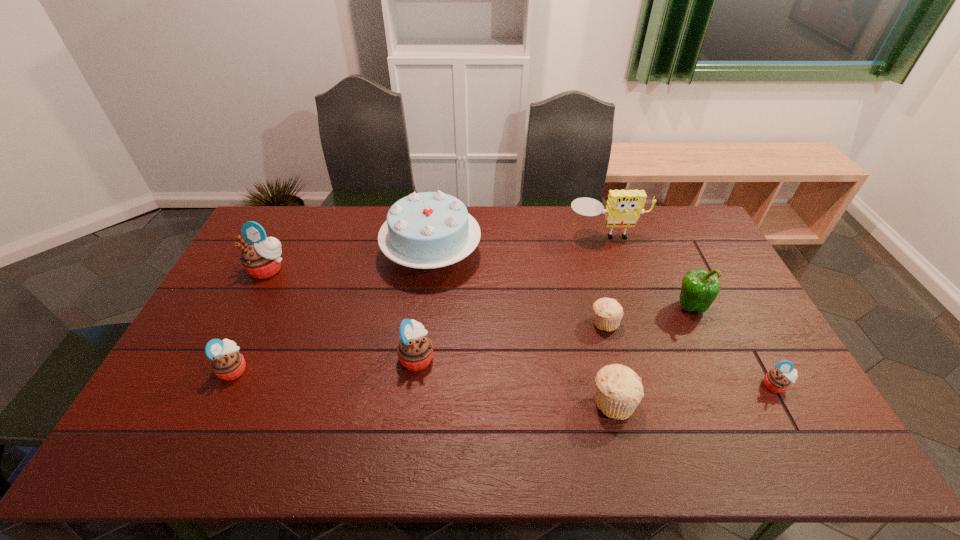
The height and width of the screenshot is (540, 960). Find the location of `free spot located on the front-facing side of the rightmost pink muffin`. free spot located on the front-facing side of the rightmost pink muffin is located at coordinates (807, 444).

Where is `blank space located on the back of the fifth nearest muffin`? This screenshot has height=540, width=960. blank space located on the back of the fifth nearest muffin is located at coordinates (591, 273).

Find the location of a particular element. birthday cake that is at the far edge is located at coordinates (x=425, y=230).

Image resolution: width=960 pixels, height=540 pixels. Identify the location of sponge that is positioned at the far edge. click(x=624, y=207).

Identify the location of bell pepper present at the right edge. (699, 289).

This screenshot has width=960, height=540. I want to click on muffin at the right edge, so click(778, 380).

In the image, there is a desktop. Find the location of `free space at the far edge`. free space at the far edge is located at coordinates (361, 220).

Identify the location of free space at the near edge of the desktop. (546, 461).

In the image, there is a desktop. Identify the location of vacant region at the left edge. The image size is (960, 540). pyautogui.click(x=210, y=361).

Where is `vacant area at the right edge of the desktop`? Image resolution: width=960 pixels, height=540 pixels. vacant area at the right edge of the desktop is located at coordinates (755, 323).